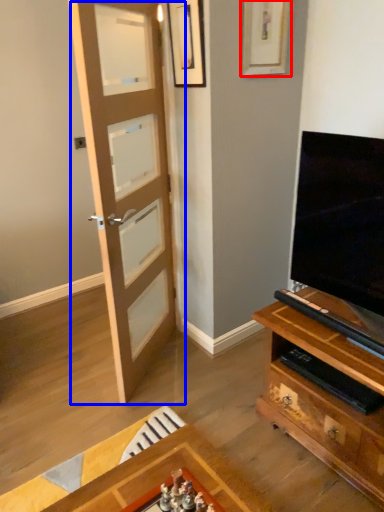
Question: Which object appears farthest to the camera in this image, picture frame (highlighted by a red box) or door (highlighted by a blue box)?

Choices:
 (A) picture frame
 (B) door

Answer: (A)